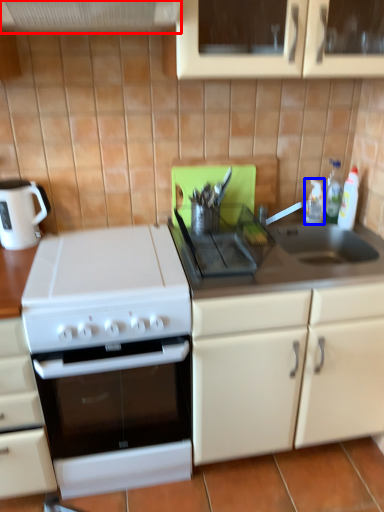
Question: Among these objects, which one is nearest to the camera, exhaust hood (highlighted by a red box) or bottle (highlighted by a blue box)?

Choices:
 (A) exhaust hood
 (B) bottle

Answer: (A)